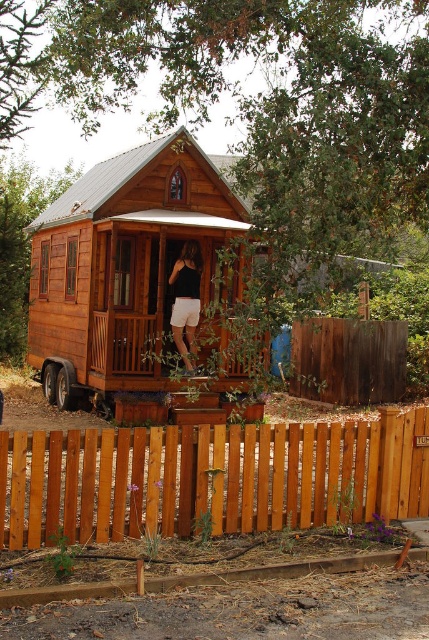
You are standing in front of the wooden cabin and notice two points marked on the porch. The first point is at coordinates point (141, 145) and the second is at point (54, 387). Which point is closer to you?

Point (141, 145) is further to the camera than point (54, 387), so the second point is closer to you.

You are standing in front of the wooden cabin and notice the wooden picket fence at center. Based on its position, can you determine if the fence is closer to the cabin or further away from it?

The wooden picket fence at center is located at point (211, 477), which indicates its position relative to the cabin. Since the coordinates are given without additional context about depth, we cannot definitively determine if the fence is closer to or further away from the cabin based solely on this information.

You are planning to place a new decorative item on the porch of the wooden cabin at center. The black rubber wheel at lower left is already there. Considering their widths, which object is wider and should be placed accordingly?

The wooden cabin at center is wider than the black rubber wheel at lower left, so it should be placed in a space that accommodates its greater width.